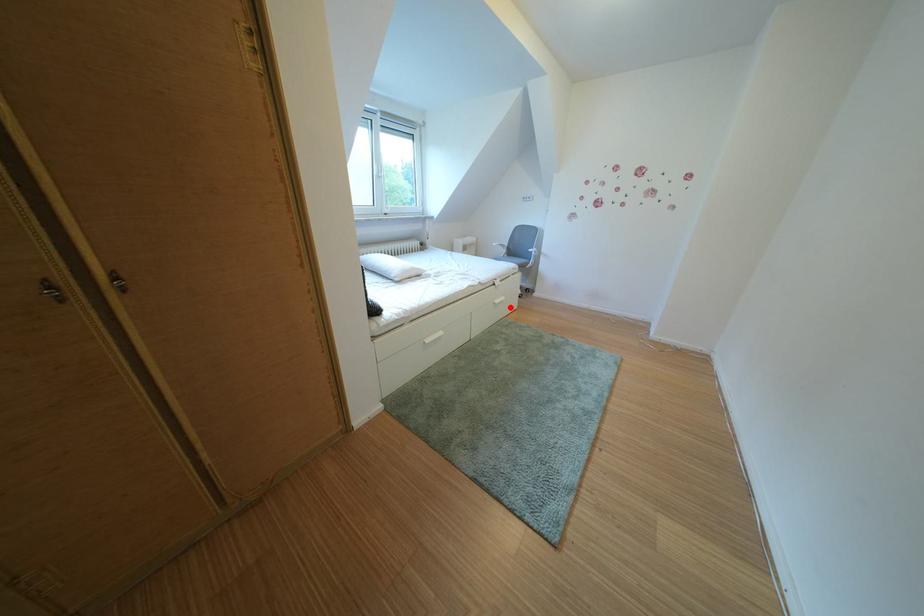
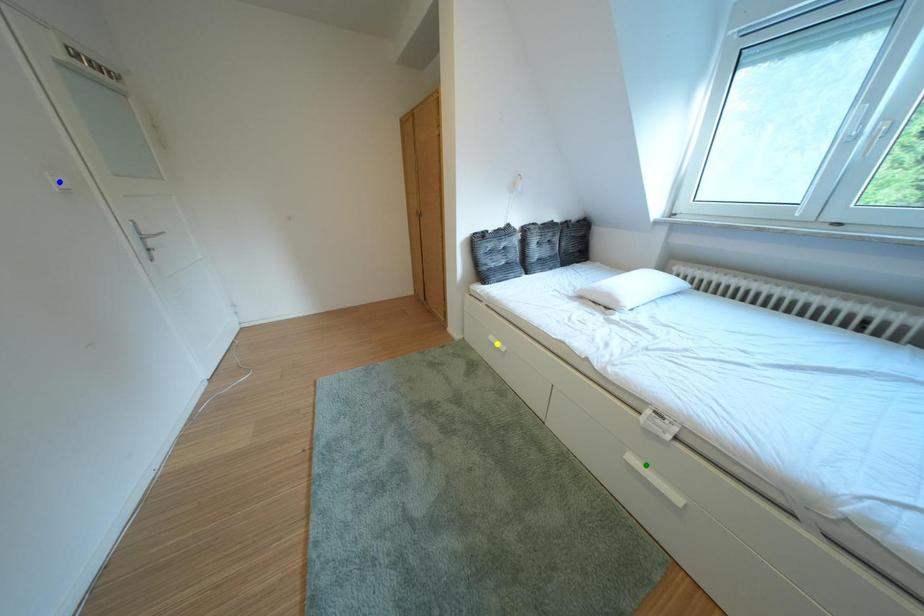
Question: I am providing you with two images of the same scene from different viewpoints. A red point is marked on the first image. You are given multiple points on the second image. Which point in image 2 is actually the same real-world point as the red point in image 1?

Choices:
 (A) green point
 (B) blue point
 (C) yellow point

Answer: (A)